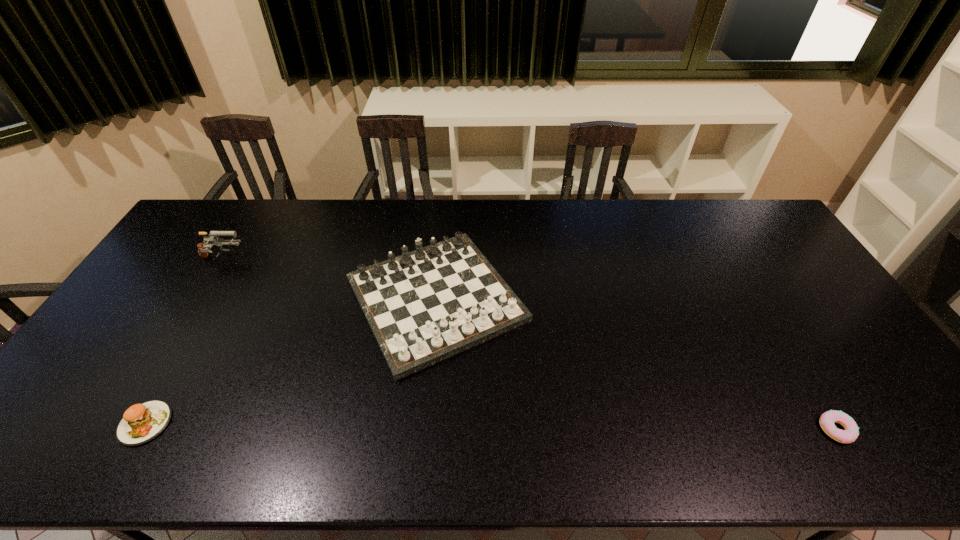
Identify the location of gun. (203, 248).

Identify the location of the third object from left to right. This screenshot has width=960, height=540. (424, 306).

Where is `the third tallest object`? This screenshot has width=960, height=540. the third tallest object is located at coordinates (141, 423).

Find the location of `the rightmost object`. the rightmost object is located at coordinates 827,419.

The width and height of the screenshot is (960, 540). Find the location of `the shortest object`. the shortest object is located at coordinates (827, 419).

Find the location of a particular element. The image size is (960, 540). vacant region located at the barrel end of the gun is located at coordinates pos(362,259).

At what (x,y) coordinates should I click in order to perform the action: click on free space located on the front of the chessboard. Please return your answer as a coordinate pair (x, y). Looking at the image, I should click on (423, 429).

You are a GUI agent. You are given a task and a screenshot of the screen. Output one action in this format:
    pyautogui.click(x=<x>, y=<y>)
    Task: Click on the vacant space situated on the right of the patty
    This screenshot has width=960, height=540.
    Given the screenshot: What is the action you would take?
    pyautogui.click(x=291, y=423)

Find the location of a particular element. The width and height of the screenshot is (960, 540). vacant space situated 0.100m on the left of the rightmost object is located at coordinates (777, 429).

I want to click on object that is at the far edge, so click(x=424, y=306).